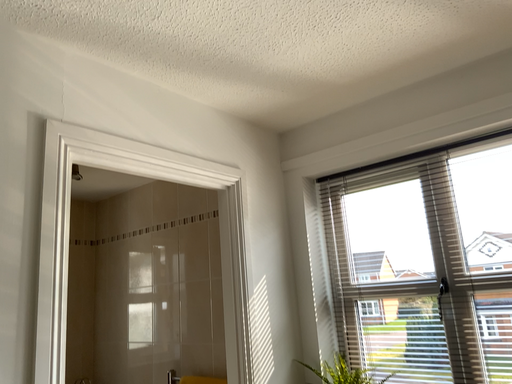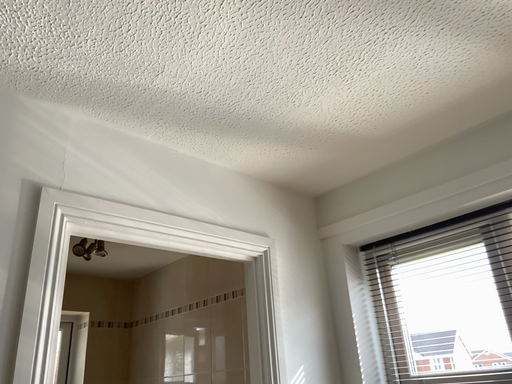
Question: Which way did the camera rotate in the video?

Choices:
 (A) rotated upward
 (B) rotated downward

Answer: (A)